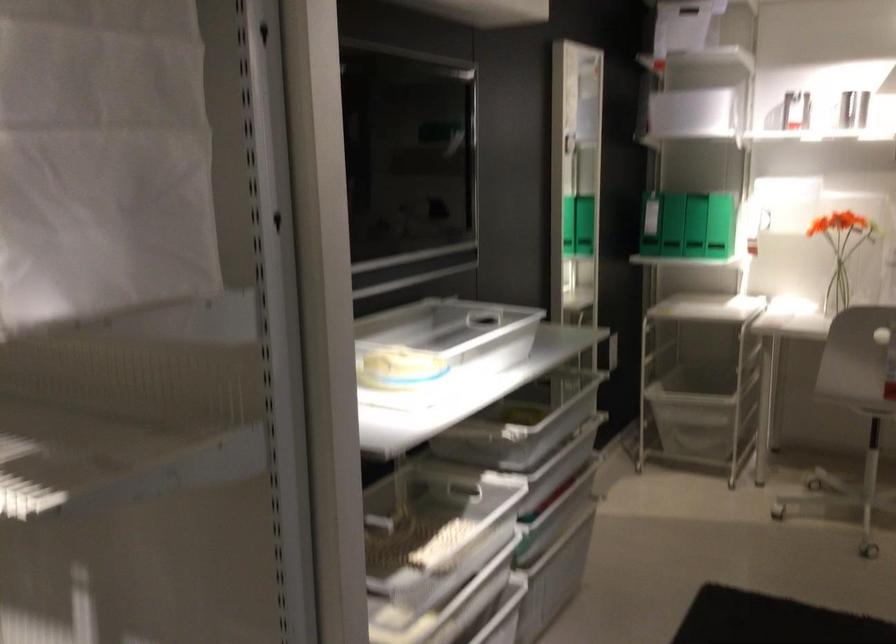
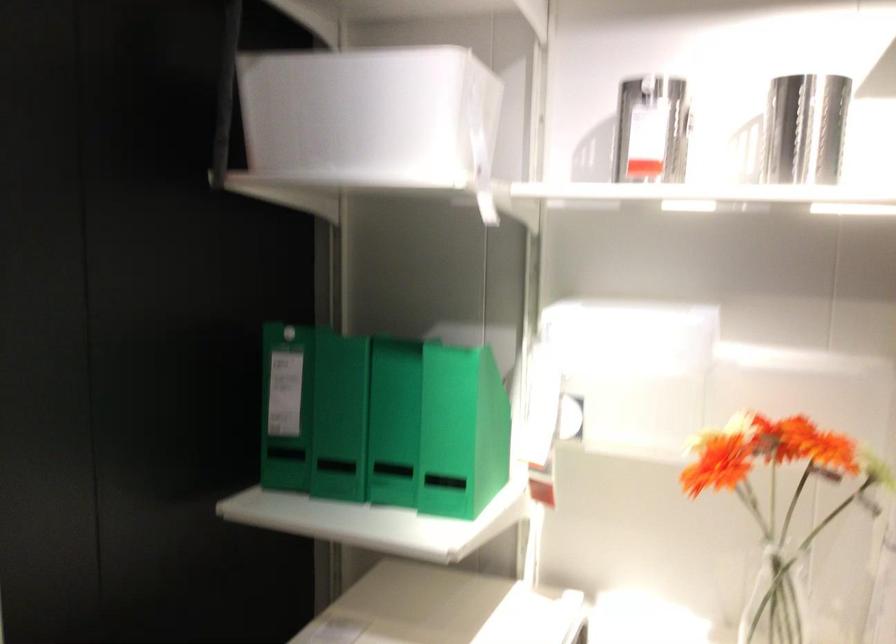
The point at (756, 205) is marked in the first image. Where is the corresponding point in the second image?

(461, 431)